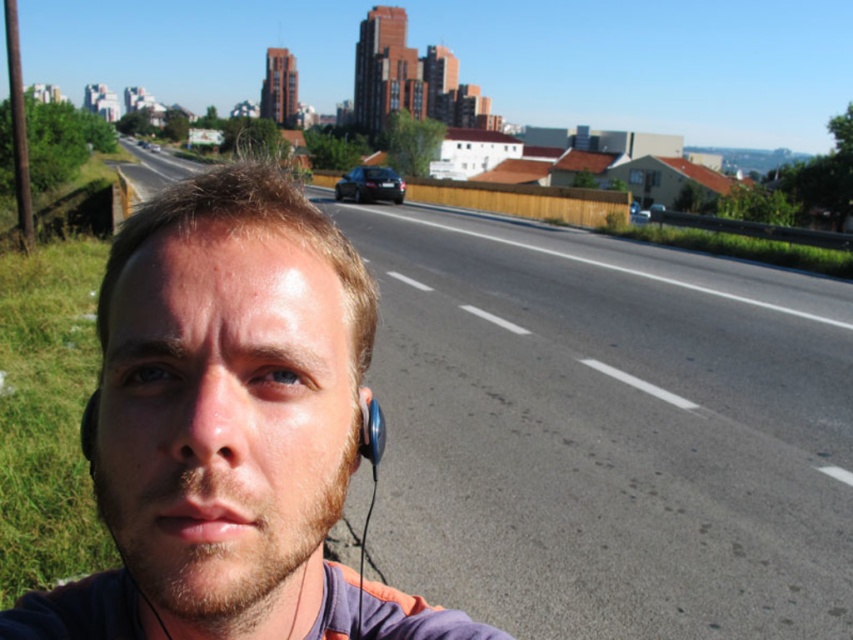
From the picture: Can you confirm if asphalt road at center is taller than smooth skin face at center?

Indeed, asphalt road at center has a greater height compared to smooth skin face at center.

Does asphalt road at center have a lesser height compared to smooth skin face at center?

No.

Identify the location of asphalt road at center. Image resolution: width=853 pixels, height=640 pixels. (607, 432).

The height and width of the screenshot is (640, 853). I want to click on asphalt road at center, so click(607, 432).

Between asphalt road at center and satin blue earphone at lower left, which one is positioned lower?

satin blue earphone at lower left is below.

Between asphalt road at center and satin blue earphone at lower left, which one has more height?

With more height is asphalt road at center.

The height and width of the screenshot is (640, 853). What do you see at coordinates (607, 432) in the screenshot?
I see `asphalt road at center` at bounding box center [607, 432].

Identify the location of asphalt road at center. click(607, 432).

Between smooth skin face at center and satin blue earphone at lower left, which one has more height?

Standing taller between the two is smooth skin face at center.

Can you confirm if smooth skin face at center is wider than satin blue earphone at lower left?

Yes.

Identify the location of smooth skin face at center. The height and width of the screenshot is (640, 853). (229, 428).